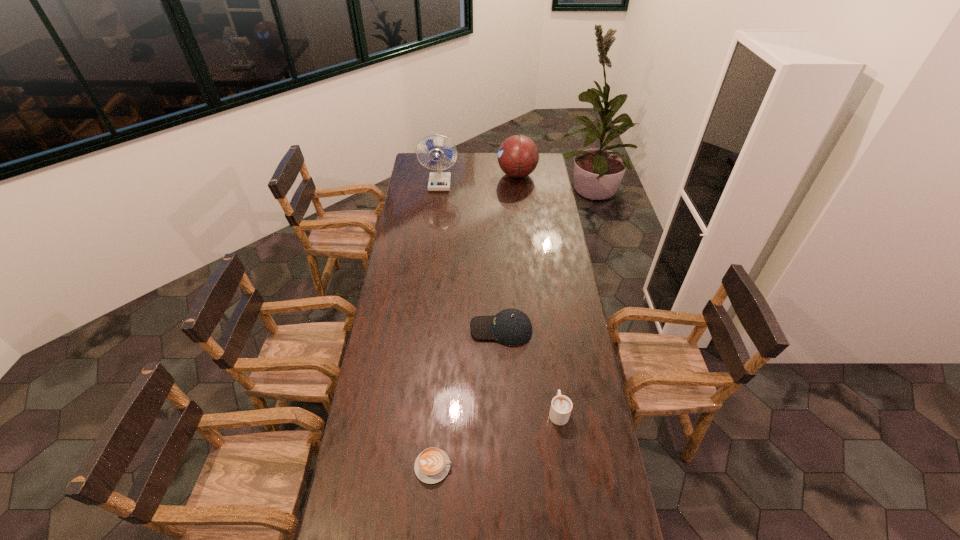
At what (x,y) coordinates should I click in order to perform the action: click on object at the far right corner. Please return your answer as a coordinate pair (x, y). This screenshot has height=540, width=960. Looking at the image, I should click on (518, 156).

Identify the location of free space at the far edge of the desktop. This screenshot has height=540, width=960. (475, 154).

What are the coordinates of `vacant space at the left edge of the desktop` in the screenshot? It's located at (408, 215).

Find the location of a particular element. The height and width of the screenshot is (540, 960). vacant space at the right edge of the desktop is located at coordinates (540, 266).

Locate an element on the screen. The image size is (960, 540). free spot between the right cappuccino and the third farthest object is located at coordinates (530, 370).

I want to click on empty location between the nearest object and the farther cappuccino, so click(495, 439).

What are the coordinates of `free spot between the basketball and the fan` in the screenshot? It's located at (478, 179).

Image resolution: width=960 pixels, height=540 pixels. In order to click on unoccupied area between the third nearest object and the fourth farthest object in this screenshot , I will do `click(530, 370)`.

Locate an element on the screen. This screenshot has width=960, height=540. free space that is in between the third farthest object and the right cappuccino is located at coordinates (x=530, y=370).

The image size is (960, 540). In order to click on vacant area that lies between the shortest object and the second nearest object in this screenshot , I will do click(x=495, y=439).